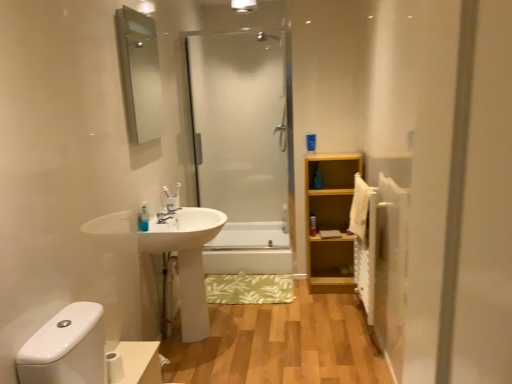
Where is `free space between white glossy sink at center left and white textured radiator at right`? Image resolution: width=512 pixels, height=384 pixels. free space between white glossy sink at center left and white textured radiator at right is located at coordinates tap(297, 320).